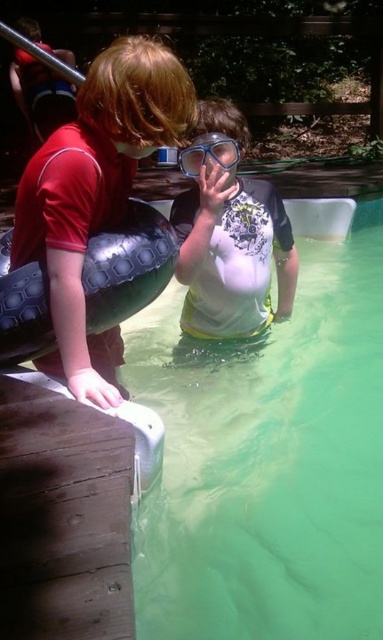
Who is more distant from viewer, (x=116, y=177) or (x=193, y=145)?

Point (x=193, y=145)

Is point (93, 145) positioned before point (199, 147)?

Yes, point (93, 145) is closer to viewer.

Measure the distance between matte red shirt at left and camera.

matte red shirt at left and camera are 4.63 feet apart from each other.

Where is `matte red shirt at left`? The height and width of the screenshot is (640, 383). matte red shirt at left is located at coordinates (96, 193).

Can you confirm if white matte swim trunks at center is smaller than transparent plastic goggles at center?

Actually, white matte swim trunks at center might be larger than transparent plastic goggles at center.

Can you confirm if white matte swim trunks at center is taller than transparent plastic goggles at center?

Indeed, white matte swim trunks at center has a greater height compared to transparent plastic goggles at center.

Is point (256, 328) behind point (198, 138)?

Yes, point (256, 328) is behind point (198, 138).

At what (x,y) coordinates should I click in order to perform the action: click on white matte swim trunks at center. Please return your answer as a coordinate pair (x, y). The image size is (383, 640). Looking at the image, I should click on (230, 236).

Does green rubber pool at center have a lesser height compared to black rubber tire at left?

No.

What do you see at coordinates (270, 452) in the screenshot? Image resolution: width=383 pixels, height=640 pixels. I see `green rubber pool at center` at bounding box center [270, 452].

What do you see at coordinates (270, 452) in the screenshot? I see `green rubber pool at center` at bounding box center [270, 452].

Image resolution: width=383 pixels, height=640 pixels. In order to click on green rubber pool at center in this screenshot , I will do `click(270, 452)`.